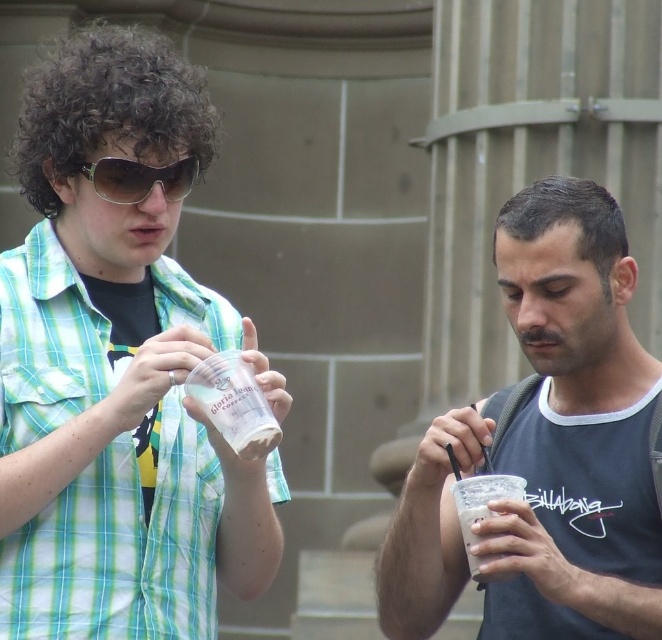
You are at a picnic and want to grab both cups without moving your position. The matte plastic cup at right and the white paper cup at center are in your line of sight. Which cup should you reach for first to get the one closer to you?

The matte plastic cup at right is located below the white paper cup at center, meaning it is closer to you. Reach for the matte plastic cup at right first.

You are at a cafe and see two cups on the table. The translucent plastic cup at center and the matte plastic cup at right. Which cup is closer to your left side?

The translucent plastic cup at center is closer to your left side because it is positioned to the left of the matte plastic cup at right.

You are at a picnic and want to pour your drink into a larger container. Which cup should you choose between the matte plastic cup at right and the white paper cup at center?

The matte plastic cup at right is bigger than the white paper cup at center, so you should choose the matte plastic cup at right to pour your drink into a larger container.